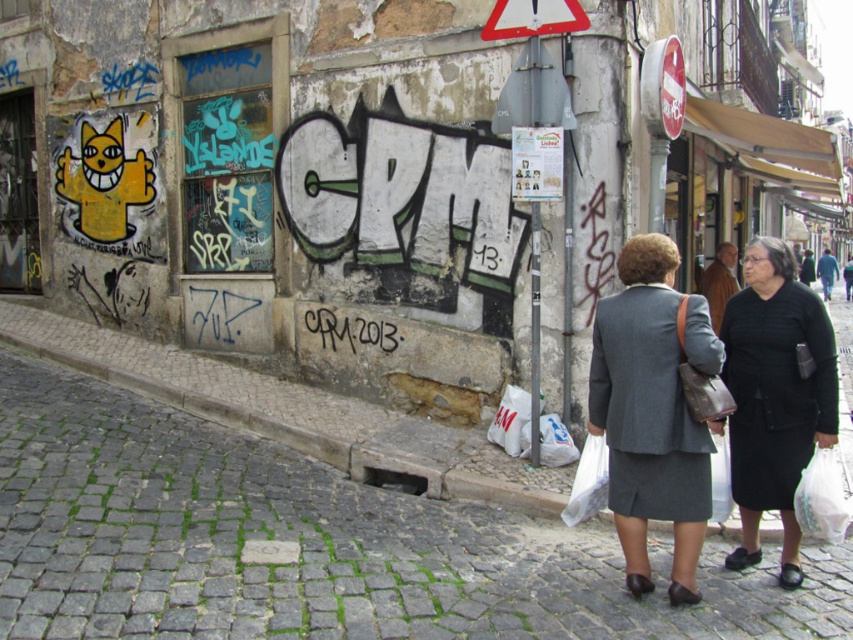
Describe the element at coordinates (314, 541) in the screenshot. I see `cobblestone pavement at lower left` at that location.

Is cobblestone pavement at lower left taller than metallic triangular sign at upper center?

No, cobblestone pavement at lower left is not taller than metallic triangular sign at upper center.

The image size is (853, 640). Identify the location of cobblestone pavement at lower left. (314, 541).

Does black matte dress at lower right have a lesser width compared to metallic triangular sign at upper center?

In fact, black matte dress at lower right might be wider than metallic triangular sign at upper center.

Based on the photo, which is below, black matte dress at lower right or metallic triangular sign at upper center?

black matte dress at lower right is below.

Is point (834, 420) behind point (527, 28)?

No, (834, 420) is closer to viewer.

Locate an element on the screen. This screenshot has height=640, width=853. black matte dress at lower right is located at coordinates (775, 396).

Can you confirm if gray wool suit at center is bigger than black graffiti at center?

Yes, gray wool suit at center is bigger than black graffiti at center.

Which is in front, point (695, 316) or point (368, 342)?

Point (695, 316) is more forward.

Where is `gray wool suit at center`? This screenshot has height=640, width=853. gray wool suit at center is located at coordinates [653, 412].